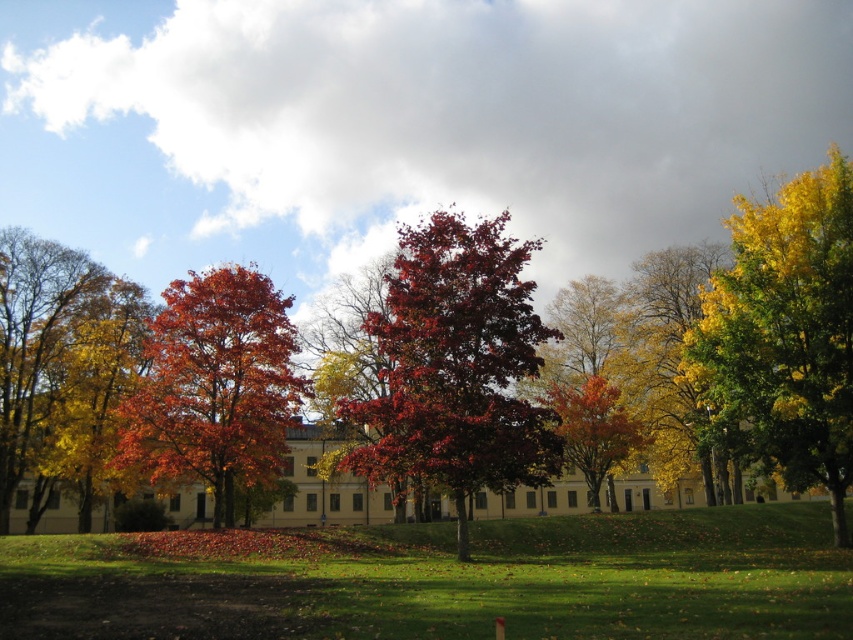
You are standing at the bottom edge of the frame where the small bright red object is located. Looking towards the center of the image, can you see the shiny crimson leaves at center? Please explain based on the scene description.

Yes, the shiny crimson leaves at center are located at point [456,365], which is towards the center of the image. Since you are at the bottom edge near the bright red object, looking towards the center would allow you to see the shiny crimson leaves at center as described.

You are standing in the autumn scene and want to pick up the shiny red leaves at center and the shiny red maple tree at center. Which object can you reach first without moving your position?

The shiny red leaves at center can be reached first because it is closer to the viewer than the shiny red maple tree at center.